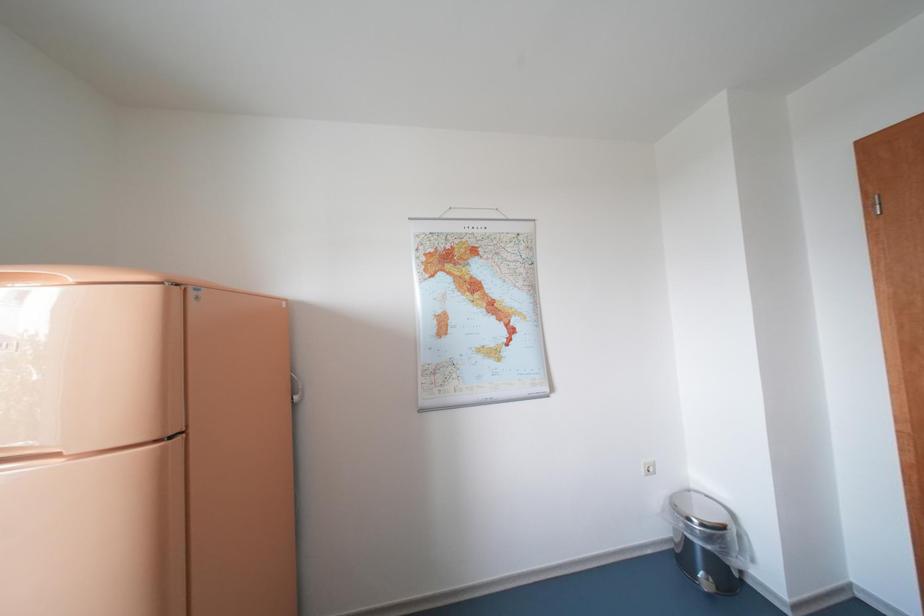
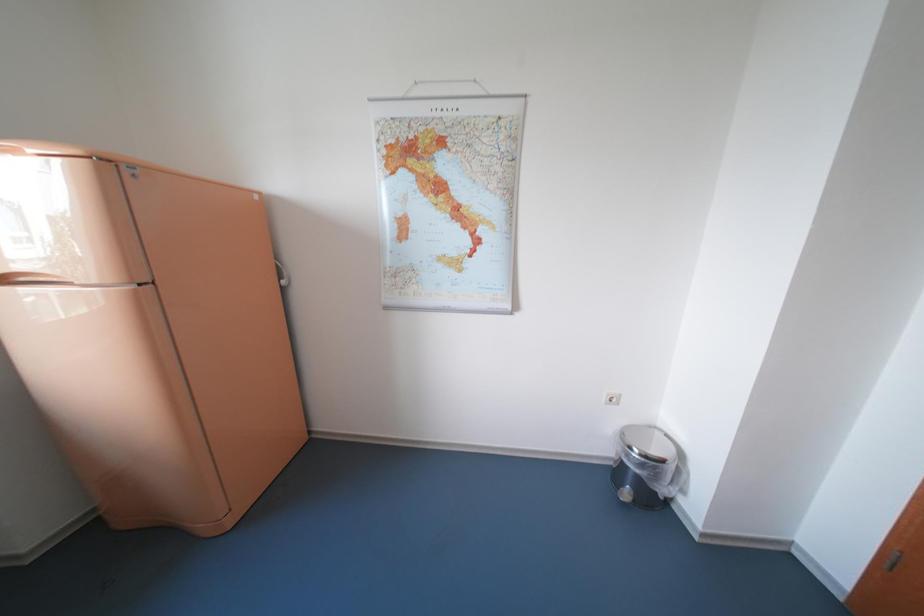
Question: What movement of the cameraman would produce the second image?

Choices:
 (A) Left
 (B) Right
 (C) Forward
 (D) Backward

Answer: (B)